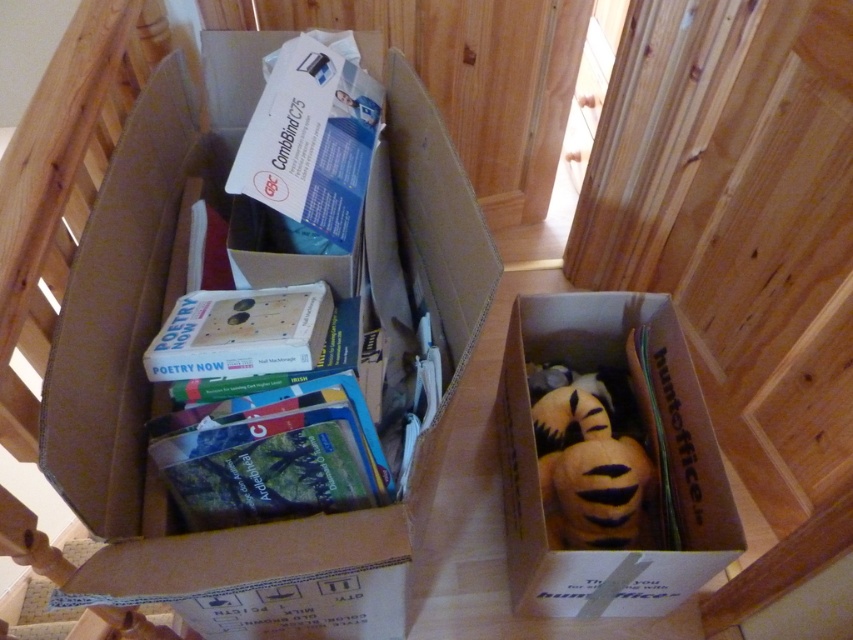
Question: Where is brown cardboard box at center located in relation to matte cardboard book at center in the image?

Choices:
 (A) above
 (B) below

Answer: (A)

Question: Where is white cardboard box at center located in relation to velvet plush toy at lower right in the image?

Choices:
 (A) right
 (B) left

Answer: (A)

Question: Which point is closer to the camera?

Choices:
 (A) (164, 333)
 (B) (10, 145)
 (C) (390, 180)

Answer: (B)

Question: Among these objects, which one is nearest to the camera?

Choices:
 (A) brown cardboard box at center
 (B) matte cardboard book at center
 (C) white cardboard box at center

Answer: (A)

Question: Based on their relative distances, which object is farther from the white cardboard box at center?

Choices:
 (A) velvet plush toy at lower right
 (B) brown cardboard box at center
 (C) hardcover book at center

Answer: (C)

Question: Is brown cardboard box at center smaller than matte cardboard book at center?

Choices:
 (A) no
 (B) yes

Answer: (A)